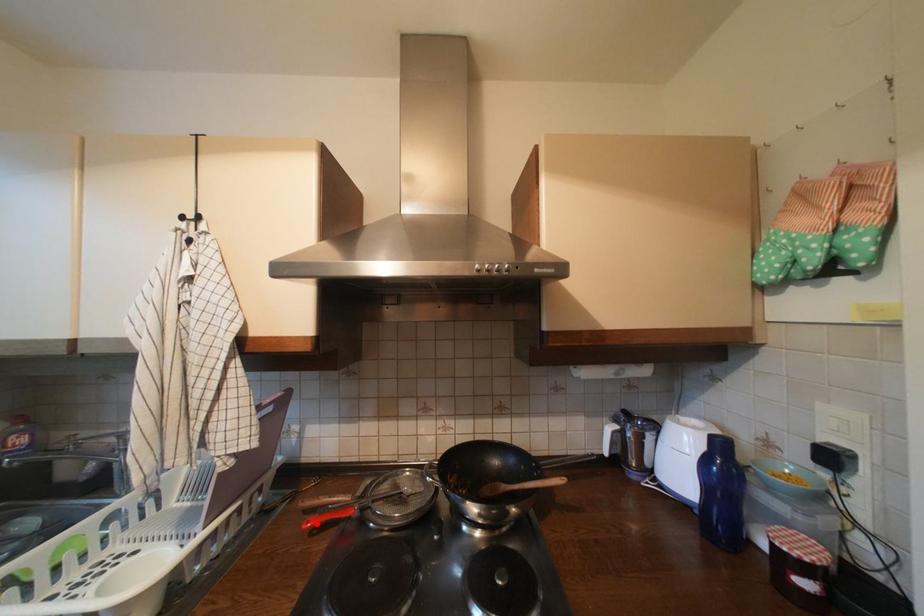
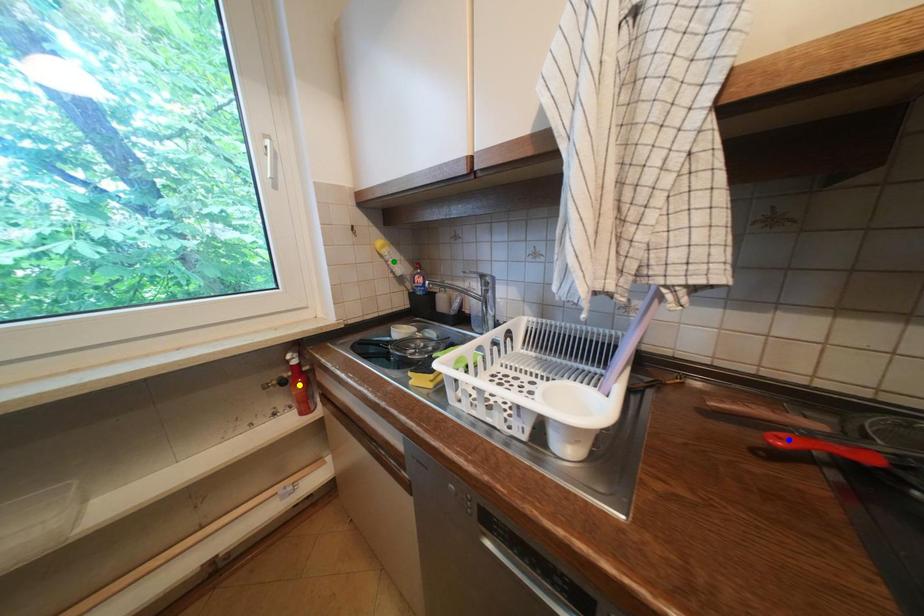
Question: I am providing you with two images of the same scene from different viewpoints. A red point is marked on the first image. You are given multiple points on the second image. Which mark in image 2 goes with the point in image 1?

Choices:
 (A) yellow point
 (B) green point
 (C) blue point

Answer: (C)